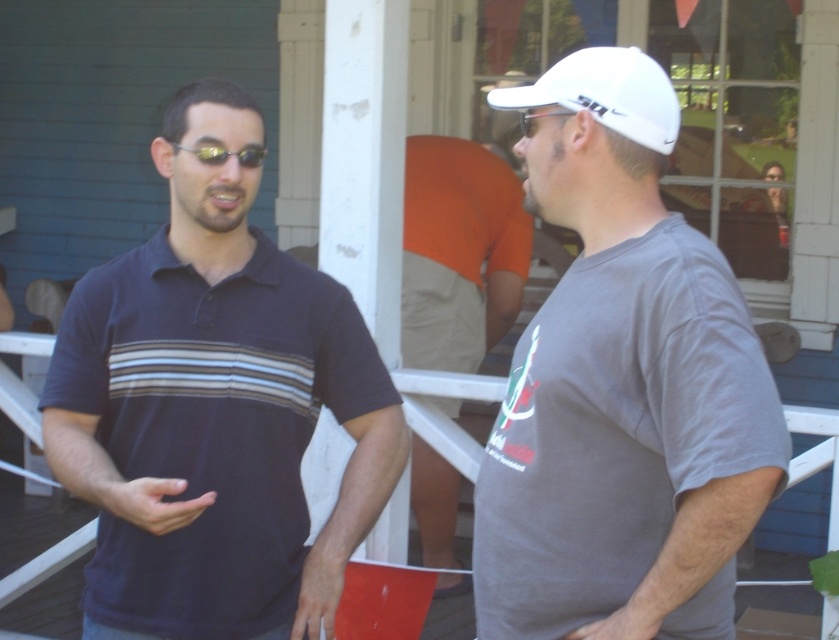
You are trying to determine if a clear plastic goggles at center can fit into a storage box that is the same width as the orange cotton shirt at center. Based on the image, can the goggles fit?

The orange cotton shirt at center might be wider than clear plastic goggles at center, so there is a possibility that the goggles can fit into the storage box if the shirt fits, but the exact width difference is uncertain.